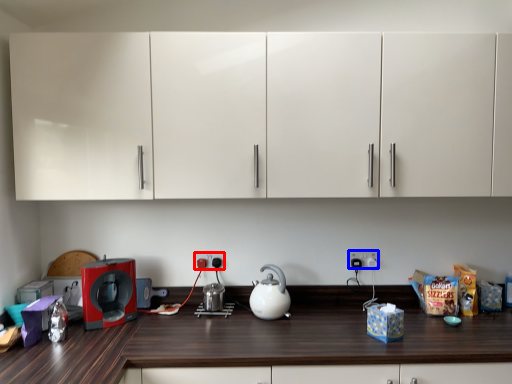
Question: Among these objects, which one is farthest to the camera, electric outlet (highlighted by a red box) or electric outlet (highlighted by a blue box)?

Choices:
 (A) electric outlet
 (B) electric outlet

Answer: (B)